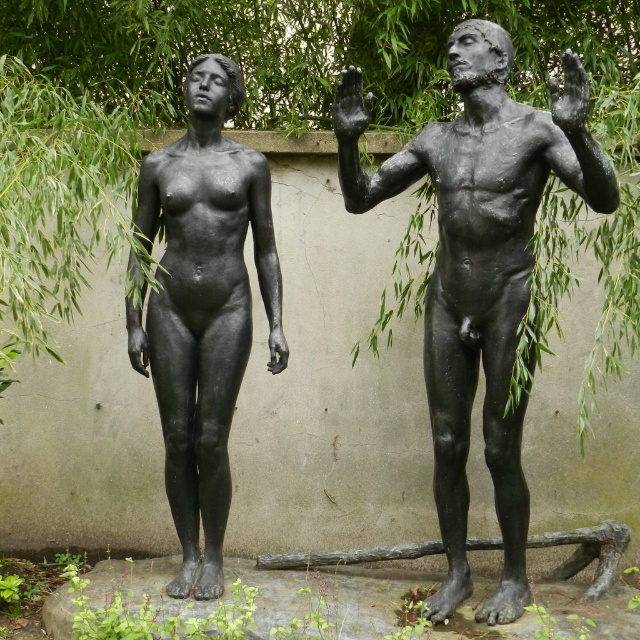
Question: Does black matte statue at center lie behind black matte hand at upper center?

Choices:
 (A) yes
 (B) no

Answer: (A)

Question: Considering the relative positions of green leafy tree at upper left and black matte statue at center in the image provided, where is green leafy tree at upper left located with respect to black matte statue at center?

Choices:
 (A) below
 (B) above

Answer: (B)

Question: In this image, where is green leafy tree at upper left located relative to black matte statue at center?

Choices:
 (A) right
 (B) left

Answer: (A)

Question: Which of the following is the farthest from the observer?

Choices:
 (A) matte black statue at right
 (B) black matte hand at upper center

Answer: (B)

Question: Which of these objects is positioned farthest from the black matte statue at center?

Choices:
 (A) matte black statue at right
 (B) black matte hand at upper center
 (C) green leafy tree at upper left

Answer: (B)

Question: Among these points, which one is nearest to the camera?

Choices:
 (A) (177, 365)
 (B) (456, 209)
 (C) (342, 81)

Answer: (C)